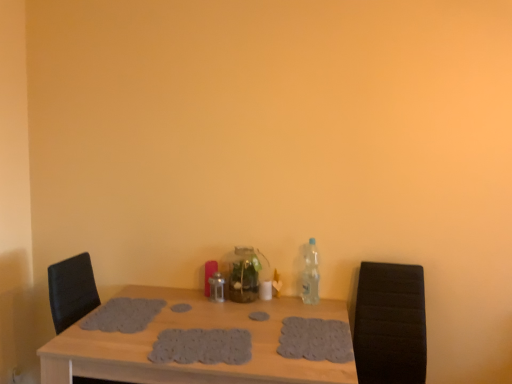
Identify the location of free space to the right of clear plastic bottle at right, the first bottle from the right. This screenshot has width=512, height=384. (334, 305).